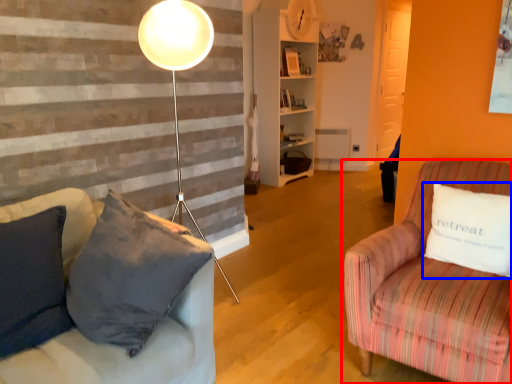
Question: Which object appears closest to the camera in this image, studio couch (highlighted by a red box) or pillow (highlighted by a blue box)?

Choices:
 (A) studio couch
 (B) pillow

Answer: (A)